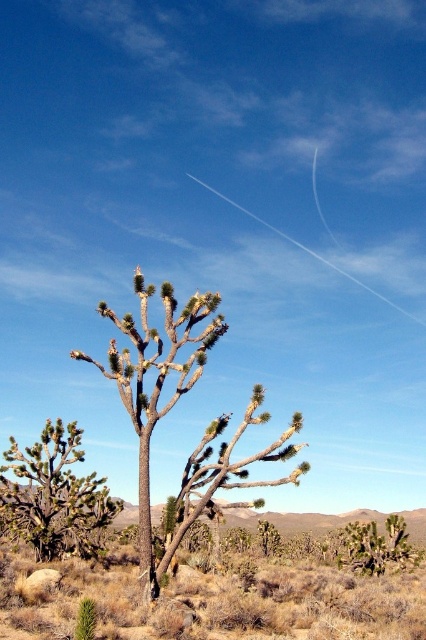
You are standing in the desert and see the brown textured tree at center. If you want to walk directly towards the tree from your current position, which direction should you face? Assume you can see the entire scene as described.

Since the brown textured tree at center is located at point 0.636 on the x axis and 0.404 on the y axis in the image, you should face towards the center of the image to walk directly towards it.

You are a desert explorer who just arrived at this desert landscape. You see the brown textured tree at center and the green spiky cactus at center. Which one is taller?

The brown textured tree at center is much taller than the green spiky cactus at center.